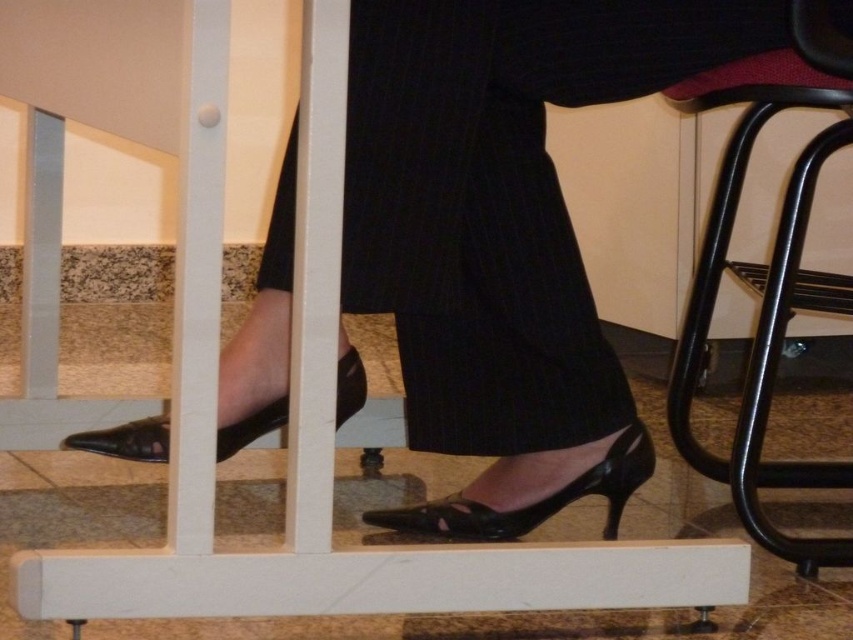
Question: Is black metal chair at right to the left of black leather shoe at center from the viewer's perspective?

Choices:
 (A) no
 (B) yes

Answer: (A)

Question: Which object is the closest to the black pinstripe skirt at center?

Choices:
 (A) black metal chair at right
 (B) black leather shoe at center
 (C) black leather shoe at lower left

Answer: (A)

Question: Which point appears closest to the camera in this image?

Choices:
 (A) (743, 163)
 (B) (341, 381)
 (C) (451, 52)
 (D) (463, 515)

Answer: (C)

Question: Which is farther from the black leather shoe at center?

Choices:
 (A) black leather shoe at lower left
 (B) black pinstripe skirt at center

Answer: (B)

Question: Is black pinstripe skirt at center further to the viewer compared to black metal chair at right?

Choices:
 (A) yes
 (B) no

Answer: (B)

Question: Can you confirm if black pinstripe skirt at center is smaller than black metal chair at right?

Choices:
 (A) no
 (B) yes

Answer: (B)